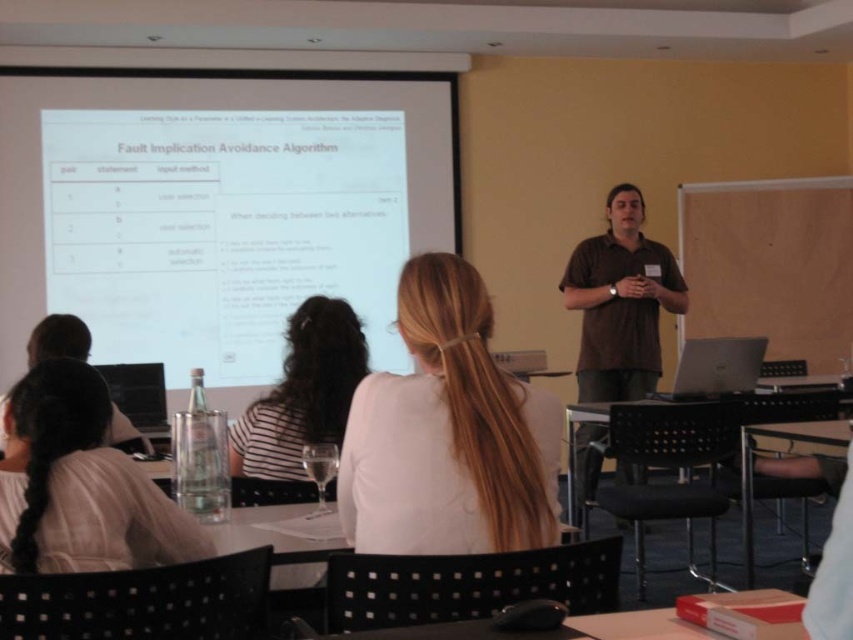
Question: Which point is farther to the camera?

Choices:
 (A) silver metallic laptop at lower right
 (B) blonde hair at upper center

Answer: (A)

Question: Based on their relative distances, which object is farther from the blonde hair at upper center?

Choices:
 (A) silver metallic laptop at lower right
 (B) clear glass water at lower left
 (C) brown cotton shirt at center
 (D) white glossy projector at upper center

Answer: (C)

Question: Which of the following is the closest to the observer?

Choices:
 (A) white striped shirt at center
 (B) white glossy projector screen at upper center

Answer: (A)

Question: Is white glossy projector screen at upper center in front of white glossy projector at upper center?

Choices:
 (A) no
 (B) yes

Answer: (A)

Question: Does blonde hair at upper center have a greater width compared to white glossy projector at upper center?

Choices:
 (A) yes
 (B) no

Answer: (A)

Question: Can you confirm if clear glass water at lower left is positioned to the right of silver metallic laptop at lower right?

Choices:
 (A) yes
 (B) no

Answer: (B)